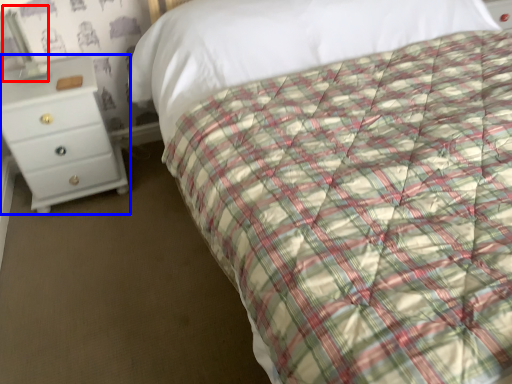
Question: Which object is closer to the camera taking this photo, bedside lamp (highlighted by a red box) or chest of drawers (highlighted by a blue box)?

Choices:
 (A) bedside lamp
 (B) chest of drawers

Answer: (A)